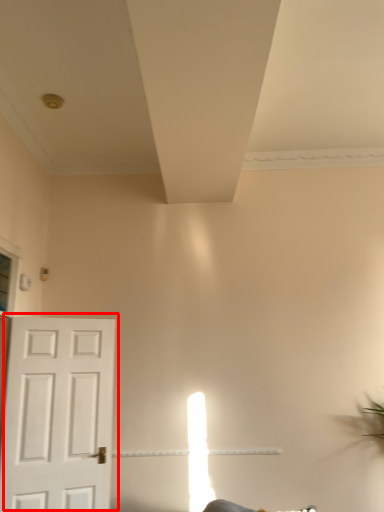
Question: From the image's perspective, what is the correct spatial positioning of door (annotated by the red box) in reference to exhaust hood?

Choices:
 (A) above
 (B) below

Answer: (B)